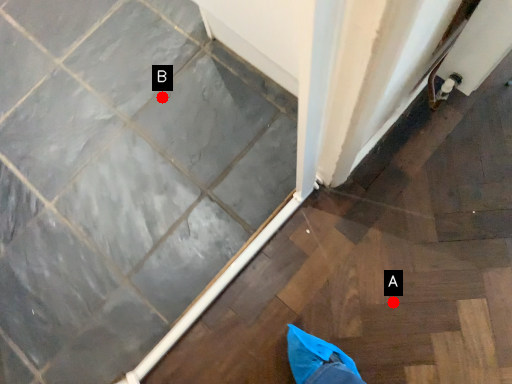
Question: Two points are circled on the image, labeled by A and B beside each circle. Among these points, which one is farthest from the camera?

Choices:
 (A) A is further
 (B) B is further

Answer: (B)